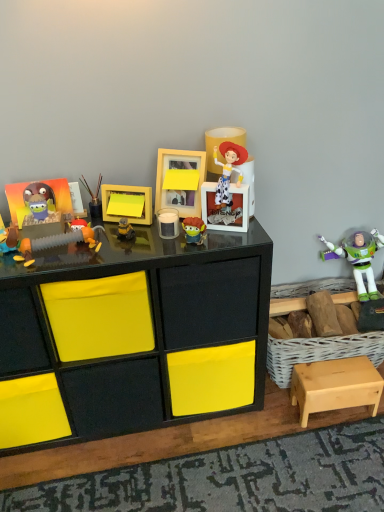
Question: Does wooden picture frame at center, which ranks as the 1th picture frame in right-to-left order, have a greater width compared to yellow matte picture frame at center, the first picture frame positioned from the left?

Choices:
 (A) yes
 (B) no

Answer: (B)

Question: From the image's perspective, would you say wooden picture frame at center, which ranks as the 1th picture frame in right-to-left order, is shown under yellow matte picture frame at center, placed as the 2th picture frame when sorted from right to left?

Choices:
 (A) yes
 (B) no

Answer: (B)

Question: Is wooden picture frame at center, which ranks as the 1th picture frame in right-to-left order, bigger than yellow matte picture frame at center, placed as the 2th picture frame when sorted from right to left?

Choices:
 (A) no
 (B) yes

Answer: (B)

Question: Is wooden picture frame at center, which ranks as the 1th picture frame in right-to-left order, closer to camera compared to yellow matte picture frame at center, placed as the 2th picture frame when sorted from right to left?

Choices:
 (A) yes
 (B) no

Answer: (A)

Question: From a real-world perspective, is wooden picture frame at center, which ranks as the 1th picture frame in right-to-left order, under yellow matte picture frame at center, placed as the 2th picture frame when sorted from right to left?

Choices:
 (A) no
 (B) yes

Answer: (A)

Question: From a real-world perspective, does wooden picture frame at center, which ranks as the 1th picture frame in right-to-left order, stand above yellow matte picture frame at center, placed as the 2th picture frame when sorted from right to left?

Choices:
 (A) no
 (B) yes

Answer: (B)

Question: From the image's perspective, is matte plastic toy at center, the sixth toy viewed from the left, located above plush toy at left, which appears as the 6th toy when viewed from the right?

Choices:
 (A) yes
 (B) no

Answer: (A)

Question: Is matte plastic toy at center, the sixth toy viewed from the left, at the right side of plush toy at left, which appears as the 6th toy when viewed from the right?

Choices:
 (A) no
 (B) yes

Answer: (B)

Question: Is matte plastic toy at center, the sixth toy viewed from the left, positioned with its back to plush toy at left, which appears as the 6th toy when viewed from the right?

Choices:
 (A) no
 (B) yes

Answer: (A)

Question: Could you tell me if matte plastic toy at center, the sixth toy viewed from the left, is turned towards plush toy at left, arranged as the second toy when viewed from the left?

Choices:
 (A) yes
 (B) no

Answer: (B)

Question: From the image's perspective, is matte plastic toy at center, the 2th toy viewed from the right, beneath plush toy at left, arranged as the second toy when viewed from the left?

Choices:
 (A) yes
 (B) no

Answer: (B)

Question: Is matte plastic toy at center, the sixth toy viewed from the left, taller than plush toy at left, which appears as the 6th toy when viewed from the right?

Choices:
 (A) no
 (B) yes

Answer: (B)

Question: Is matte orange toy at center-left, which is the third toy from left to right, wider than plush toy at left, arranged as the second toy when viewed from the left?

Choices:
 (A) yes
 (B) no

Answer: (B)